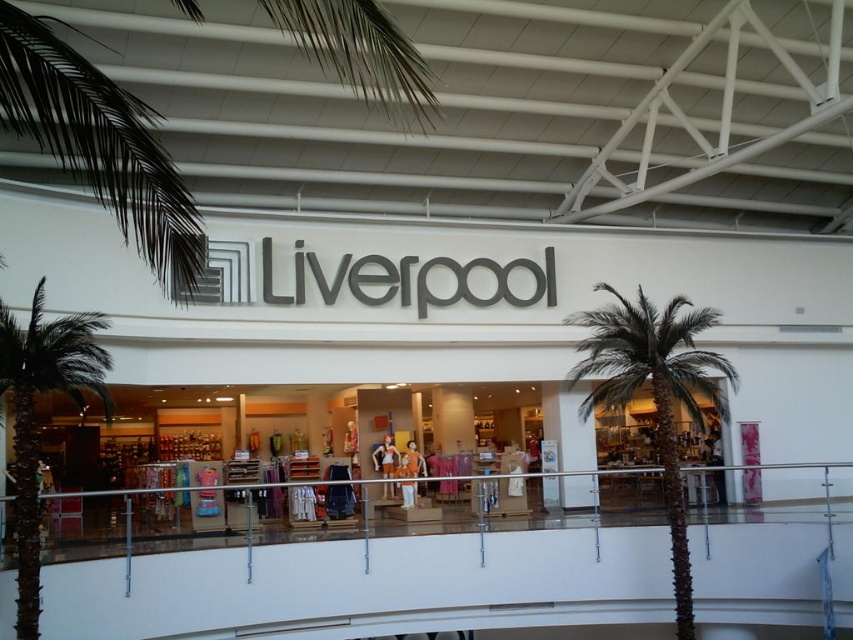
Which of these two, brown textured palm tree at center or green leafy palm tree at left, stands taller?

Standing taller between the two is green leafy palm tree at left.

Can you confirm if brown textured palm tree at center is smaller than green leafy palm tree at left?

Yes.

Which is in front, point (592, 328) or point (38, 468)?

Point (38, 468) is in front.

The height and width of the screenshot is (640, 853). I want to click on brown textured palm tree at center, so click(x=654, y=394).